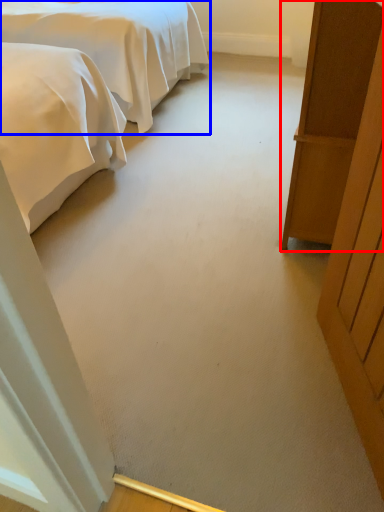
Question: Which object appears closest to the camera in this image, furniture (highlighted by a red box) or bed (highlighted by a blue box)?

Choices:
 (A) furniture
 (B) bed

Answer: (A)